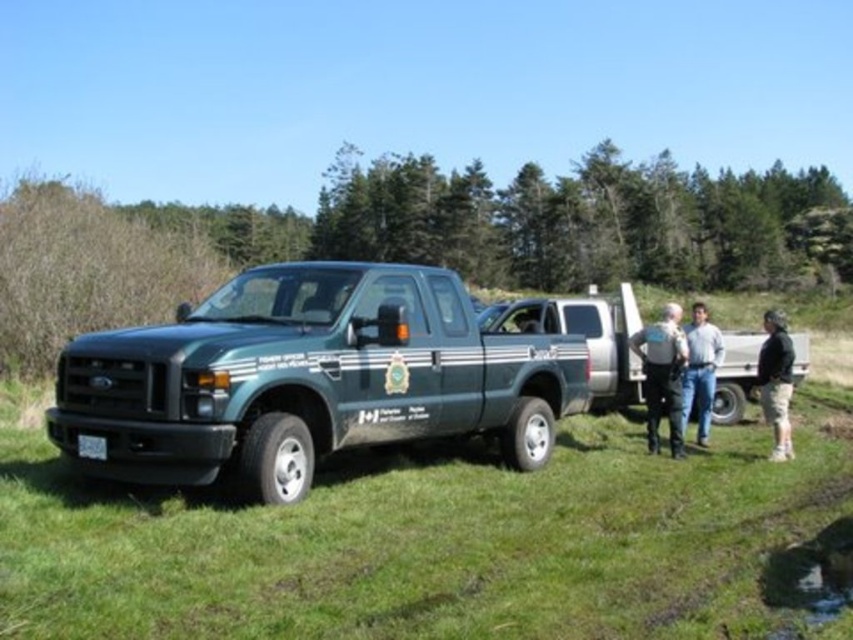
Question: Can you confirm if silver metallic pickup truck at center is positioned below dark gray uniform at center?

Choices:
 (A) yes
 (B) no

Answer: (B)

Question: Estimate the real-world distances between objects in this image. Which object is farther from the silver metallic pickup truck at center?

Choices:
 (A) green matte truck at left
 (B) black cotton pants at lower right

Answer: (A)

Question: Does green grass at lower left have a larger size compared to silver metallic pickup truck at center?

Choices:
 (A) yes
 (B) no

Answer: (B)

Question: Considering the relative positions of dark gray uniform at center and jeans at center in the image provided, where is dark gray uniform at center located with respect to jeans at center?

Choices:
 (A) above
 (B) below

Answer: (B)

Question: Which object is closer to the camera taking this photo?

Choices:
 (A) jeans at center
 (B) green matte truck at left
 (C) dark gray uniform at center
 (D) green grass at lower left

Answer: (D)

Question: Which object is farther from the camera taking this photo?

Choices:
 (A) jeans at center
 (B) dark gray uniform at center

Answer: (A)